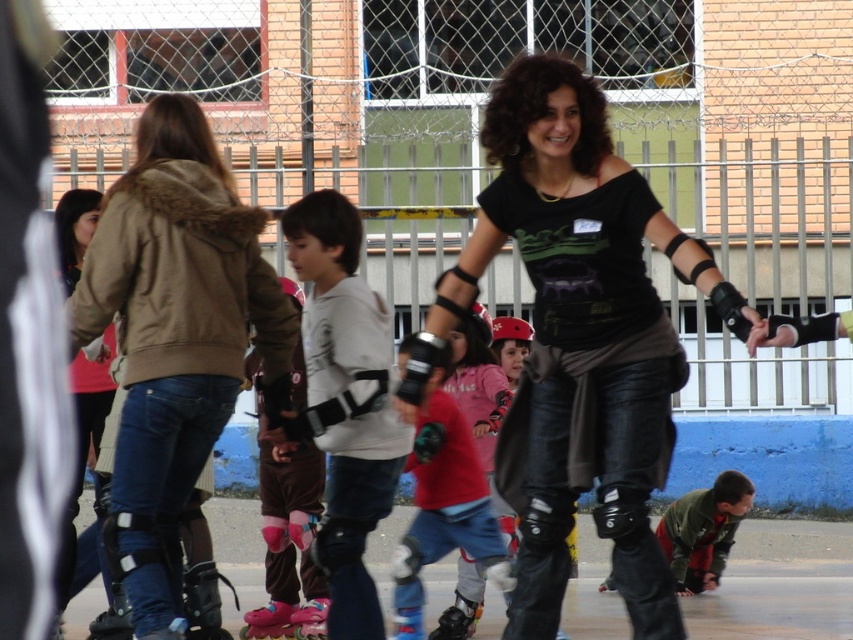
Question: Which of the following is the closest to the observer?

Choices:
 (A) green fabric jacket at lower right
 (B) matte pink roller skate at lower center

Answer: (B)

Question: Considering the real-world distances, which object is farthest from the pink fabric pants at center?

Choices:
 (A) matte brown jacket at center
 (B) green fabric jacket at lower right
 (C) matte pink shirt at center
 (D) black matte roller skate at lower left

Answer: (B)

Question: Where is matte pink shirt at center located in relation to black matte roller skate at lower left in the image?

Choices:
 (A) right
 (B) left

Answer: (A)

Question: Does white matte knee pads at center appear over matte pink shirt at center?

Choices:
 (A) no
 (B) yes

Answer: (A)

Question: Estimate the real-world distances between objects in this image. Which object is farther from the black matte roller skate at lower left?

Choices:
 (A) matte pink shirt at center
 (B) pink rubber roller skate at lower center
 (C) matte brown jacket at center
 (D) pink fabric pants at center

Answer: (A)

Question: Does white matte knee pads at center appear over matte pink shirt at center?

Choices:
 (A) no
 (B) yes

Answer: (A)